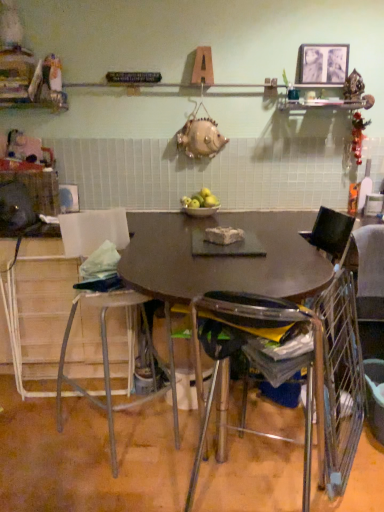
Question: Can you confirm if green matte apples at center is positioned to the left of clear plastic chair at center, the second chair from the right?

Choices:
 (A) no
 (B) yes

Answer: (B)

Question: Is green matte apples at center aimed at clear plastic chair at center, the second chair from the right?

Choices:
 (A) yes
 (B) no

Answer: (B)

Question: Does green matte apples at center have a larger size compared to clear plastic chair at center, the 2th chair in the left-to-right sequence?

Choices:
 (A) yes
 (B) no

Answer: (B)

Question: Is clear plastic chair at center, the second chair from the right, at the back of green matte apples at center?

Choices:
 (A) yes
 (B) no

Answer: (B)

Question: Is green matte apples at center at the right side of clear plastic chair at center, the 2th chair in the left-to-right sequence?

Choices:
 (A) yes
 (B) no

Answer: (B)

Question: Based on their positions, is matte brown table at center located to the left or right of green matte apples at center?

Choices:
 (A) right
 (B) left

Answer: (A)

Question: From the image's perspective, relative to green matte apples at center, is matte brown table at center above or below?

Choices:
 (A) above
 (B) below

Answer: (B)

Question: Based on their sizes in the image, would you say matte brown table at center is bigger or smaller than green matte apples at center?

Choices:
 (A) big
 (B) small

Answer: (A)

Question: From a real-world perspective, is matte brown table at center above or below green matte apples at center?

Choices:
 (A) below
 (B) above

Answer: (A)

Question: Would you say clear plastic chair at center, the second chair from the right, is to the left or to the right of metallic wire chair at right, marked as the 3th chair in a left-to-right arrangement, in the picture?

Choices:
 (A) right
 (B) left

Answer: (B)

Question: Looking at their shapes, would you say clear plastic chair at center, the 2th chair in the left-to-right sequence, is wider or thinner than metallic wire chair at right, arranged as the first chair when viewed from the right?

Choices:
 (A) wide
 (B) thin

Answer: (A)

Question: Considering the positions of point (284, 304) and point (319, 214), is point (284, 304) closer or farther from the camera than point (319, 214)?

Choices:
 (A) farther
 (B) closer

Answer: (B)

Question: Looking at the image, does clear plastic chair at center, the second chair from the right, seem bigger or smaller compared to metallic wire chair at right, arranged as the first chair when viewed from the right?

Choices:
 (A) big
 (B) small

Answer: (A)

Question: Does point (304, 57) appear closer or farther from the camera than point (102, 344)?

Choices:
 (A) closer
 (B) farther

Answer: (B)

Question: From a real-world perspective, is metallic silver picture frame at upper right above or below metallic stool at lower left, the 3th chair from the right?

Choices:
 (A) below
 (B) above

Answer: (B)